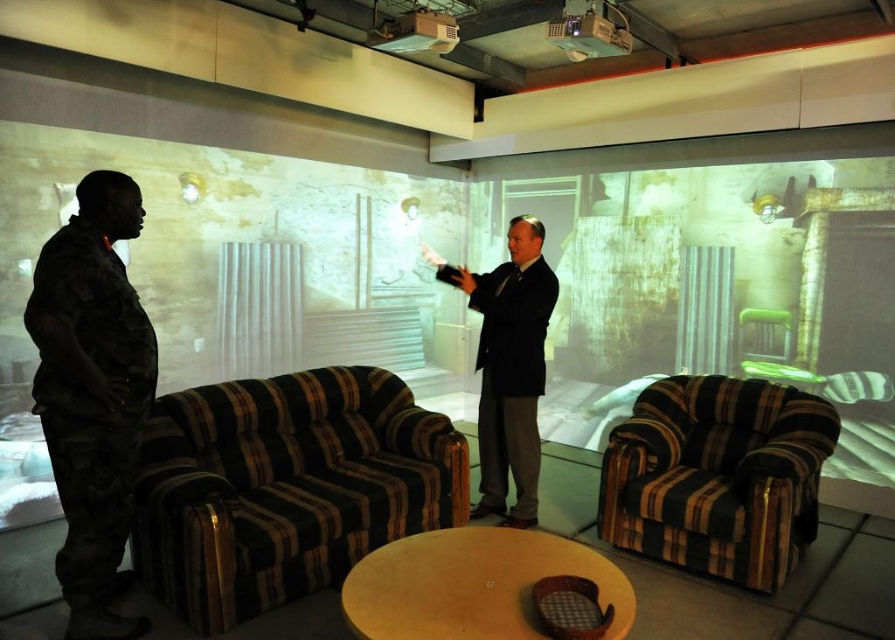
Can you confirm if dark suit at center is bigger than matte black projector at upper center?

Yes, dark suit at center is bigger than matte black projector at upper center.

Which is above, dark suit at center or matte black projector at upper center?

matte black projector at upper center is higher up.

You are a GUI agent. You are given a task and a screenshot of the screen. Output one action in this format:
    pyautogui.click(x=<x>, y=<y>)
    Task: Click on the dark suit at center
    The width and height of the screenshot is (895, 640).
    Given the screenshot: What is the action you would take?
    pyautogui.click(x=509, y=365)

Locate an element on the screen. This screenshot has height=640, width=895. dark suit at center is located at coordinates (509, 365).

How much distance is there between striped fabric couch at center and matte black projector at upper center?

striped fabric couch at center and matte black projector at upper center are 7.82 feet apart.

Does striped fabric couch at center appear under matte black projector at upper center?

Correct, striped fabric couch at center is located below matte black projector at upper center.

Who is more forward, (304,406) or (412,16)?

Point (304,406)

Where is `striped fabric couch at center`? striped fabric couch at center is located at coordinates (286, 486).

Does camouflage fabric at left lie in front of striped fabric armchair at center?

Yes.

Is camouflage fabric at left taller than striped fabric armchair at center?

Indeed, camouflage fabric at left has a greater height compared to striped fabric armchair at center.

Does point (78, 611) lie in front of point (810, 476)?

Yes, point (78, 611) is closer to viewer.

I want to click on camouflage fabric at left, so click(92, 394).